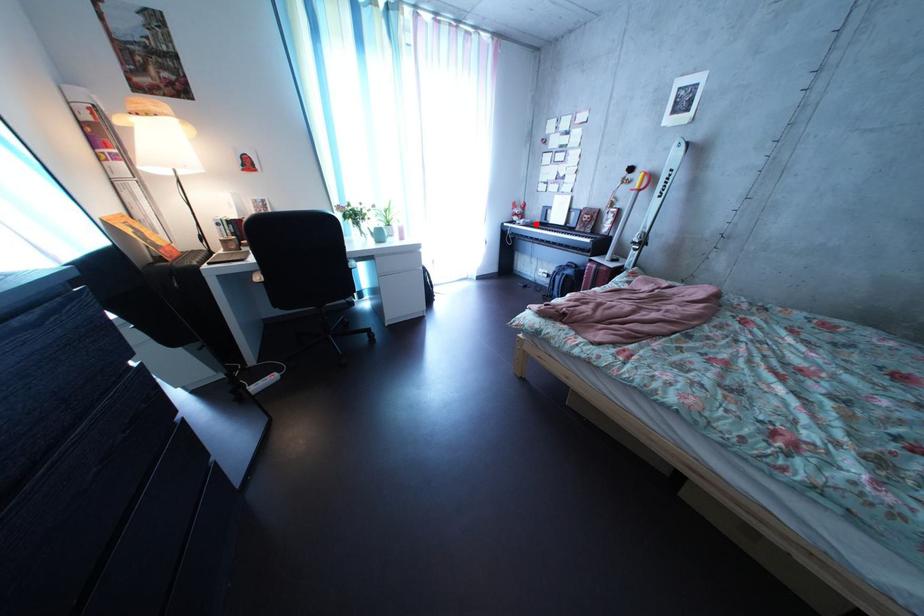
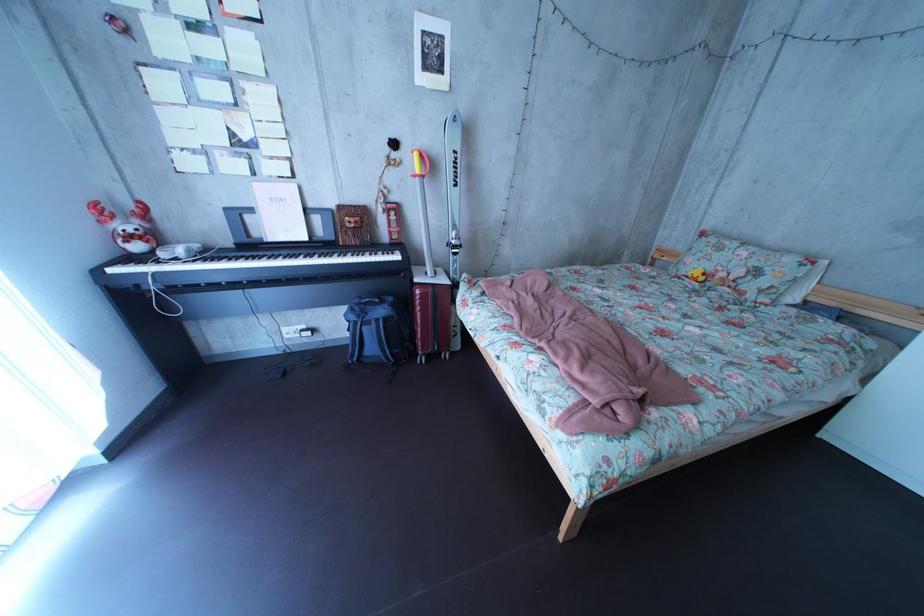
Where in the second image is the point corresponding to the highlighted location from the first image?

(169, 246)